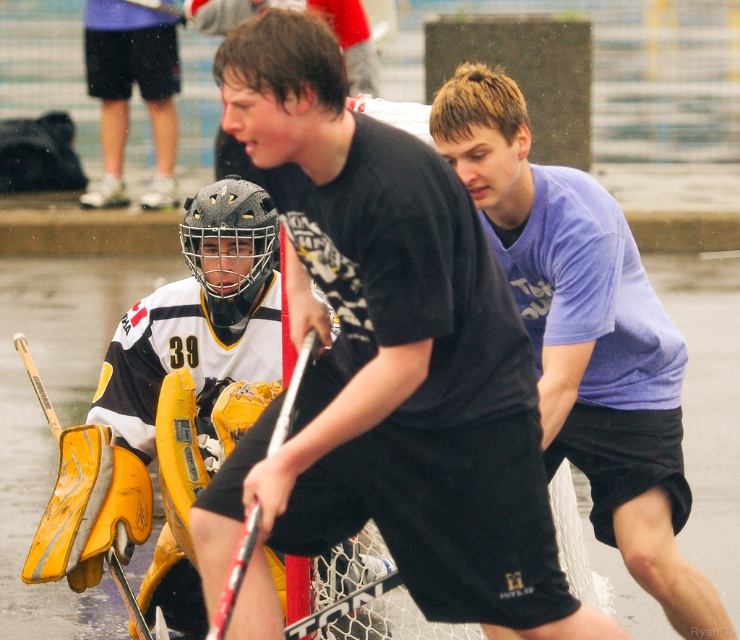
What is the color of the object located at the coordinates point (585,337)?

The object located at point (585,337) is purple cotton shirt at center.

You are a hockey player trying to position yourself correctly for the game. Based on the image, where are the yellow matte goalie pads at lower left in relation to the goal? Please provide their coordinates.

The yellow matte goalie pads at lower left are located at coordinates point (198,317) according to the image description.

You are a photographer at the hockey game and want to capture a closeup of the purple cotton shirt at center and black matte shorts at center. Which one should you zoom in on to ensure both are in focus?

The purple cotton shirt at center has a larger size compared to black matte shorts at center, so zooming in on the purple cotton shirt at center will ensure both are in focus.